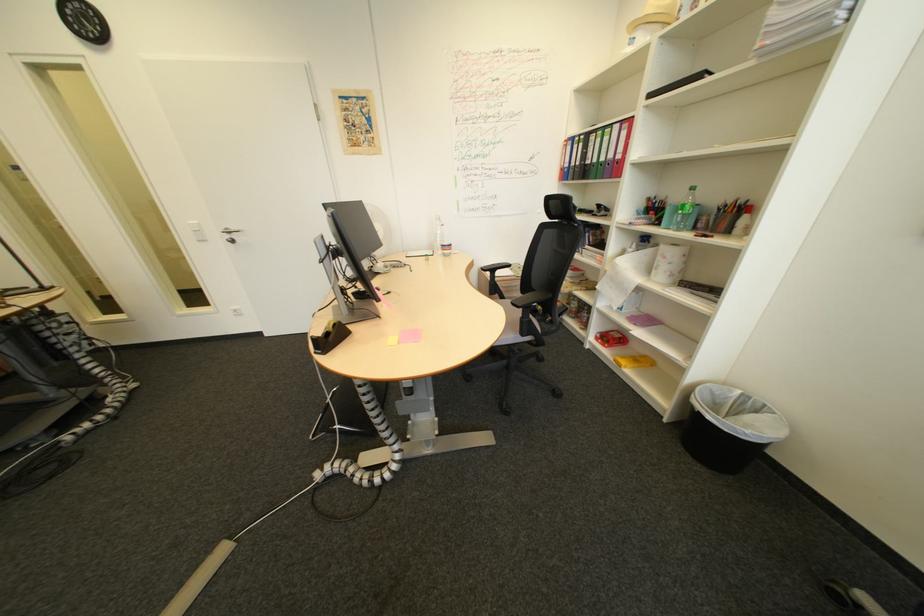
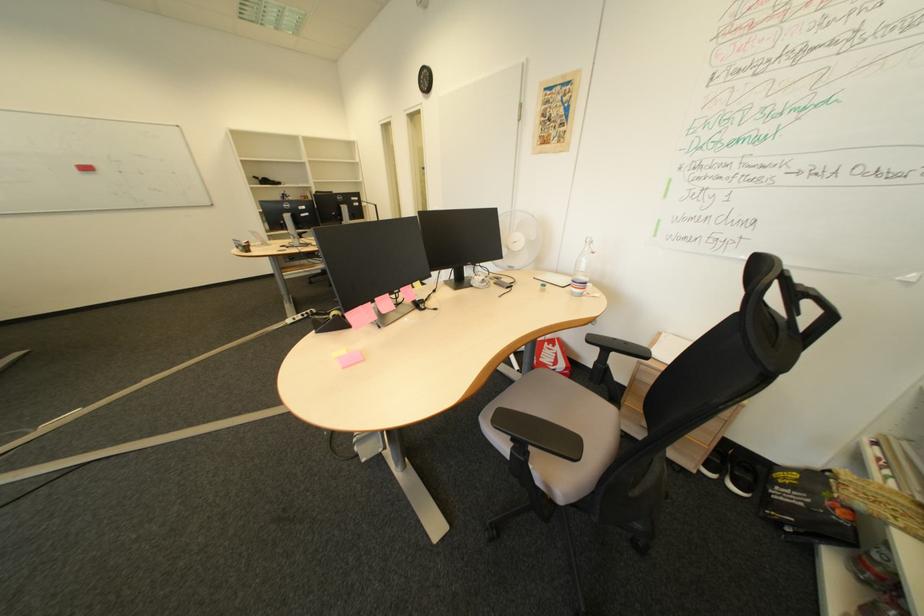
Question: The camera is either moving clockwise (left) or counter-clockwise (right) around the object. The first image is from the beginning of the video and the second image is from the end. Is the camera moving left or right when shooting the video?

Choices:
 (A) Left
 (B) Right

Answer: (B)